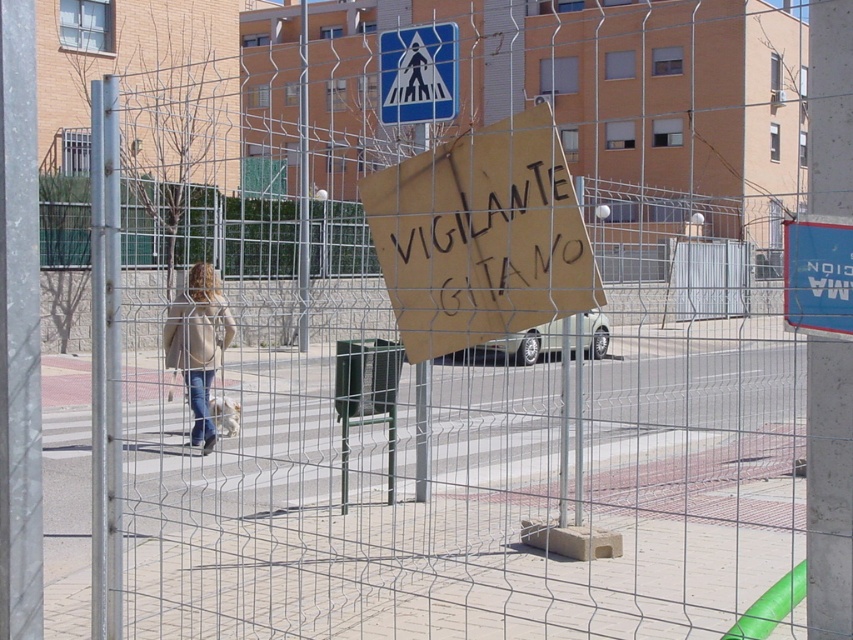
Can you confirm if blue plastic sign at upper right is taller than brushed metal pole at center?

Incorrect, blue plastic sign at upper right's height is not larger of brushed metal pole at center's.

Is blue plastic sign at upper right wider than brushed metal pole at center?

In fact, blue plastic sign at upper right might be narrower than brushed metal pole at center.

This screenshot has height=640, width=853. What do you see at coordinates (817, 278) in the screenshot? I see `blue plastic sign at upper right` at bounding box center [817, 278].

Where is `blue plastic sign at upper right`? blue plastic sign at upper right is located at coordinates (817, 278).

Is blue plastic sign at upper right positioned behind light beige jacket at center?

No, blue plastic sign at upper right is closer to the viewer.

Does point (791, 292) come in front of point (177, 339)?

That is True.

Is point (840, 236) farther from viewer compared to point (207, 314)?

That is False.

Identify the location of blue plastic sign at upper right. (817, 278).

Can you confirm if light beige jacket at center is shorter than brushed metal pole at center?

Correct, light beige jacket at center is not as tall as brushed metal pole at center.

Is light beige jacket at center to the right of brushed metal pole at center from the viewer's perspective?

Indeed, light beige jacket at center is positioned on the right side of brushed metal pole at center.

This screenshot has width=853, height=640. Find the location of `light beige jacket at center`. light beige jacket at center is located at coordinates click(198, 342).